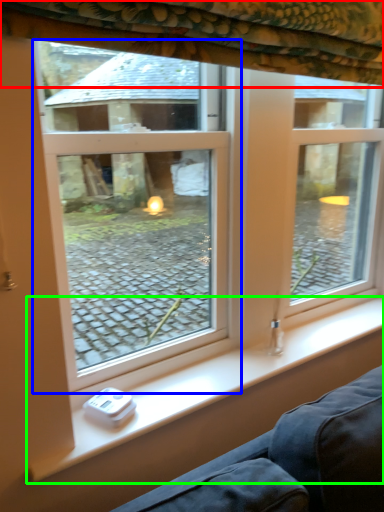
Question: Which object is positioned farthest from curtain (highlighted by a red box)? Select from window (highlighted by a blue box) and window sill (highlighted by a green box).

Choices:
 (A) window
 (B) window sill

Answer: (A)